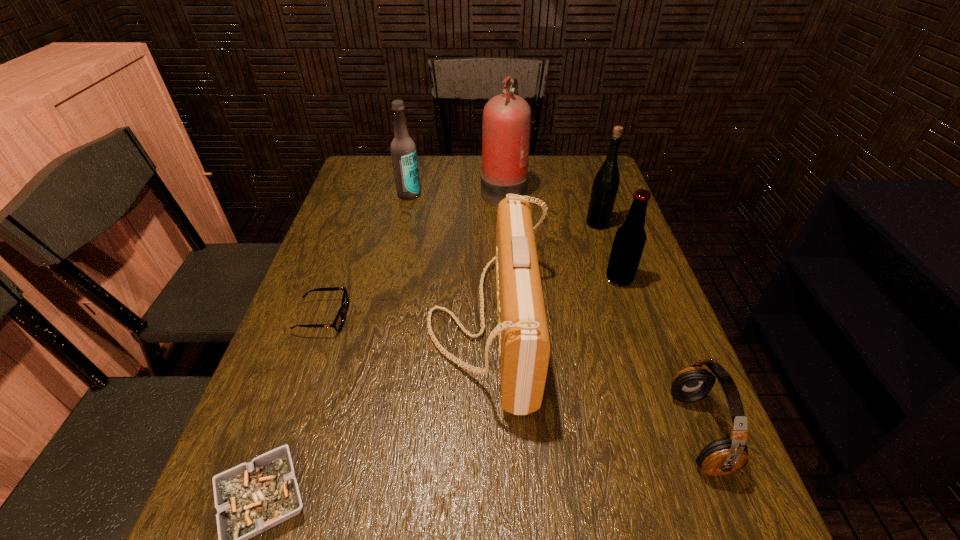
You are a GUI agent. You are given a task and a screenshot of the screen. Output one action in this format:
    pyautogui.click(x=<x>, y=<y>)
    Task: Click on the tallest object
    This screenshot has height=540, width=960.
    Given the screenshot: What is the action you would take?
    pyautogui.click(x=506, y=125)

You are a GUI agent. You are given a task and a screenshot of the screen. Output one action in this format:
    pyautogui.click(x=<x>, y=<y>)
    Task: Click on the leftmost beer bottle
    This screenshot has width=960, height=540.
    Given the screenshot: What is the action you would take?
    pyautogui.click(x=403, y=149)

The image size is (960, 540). Identify the location of the farthest beer bottle. (403, 149).

You are a GUI agent. You are given a task and a screenshot of the screen. Output one action in this format:
    pyautogui.click(x=<x>, y=<y>)
    Task: Click on the second nearest beer bottle
    
    Given the screenshot: What is the action you would take?
    pyautogui.click(x=606, y=183)

Locate an element on the screen. Image resolution: width=960 pixels, height=540 pixels. handbag is located at coordinates (524, 345).

Where is `the nearest beer bottle`? the nearest beer bottle is located at coordinates (630, 238).

Locate an element on the screen. The width and height of the screenshot is (960, 540). the third shortest object is located at coordinates (725, 456).

Locate an element on the screen. The height and width of the screenshot is (540, 960). sunglasses is located at coordinates (338, 323).

Locate an element on the screen. free space located 0.280m at the nozzle of the tallest object is located at coordinates click(393, 189).

At what (x,y) coordinates should I click in order to perform the action: click on vacant space located at the nozzle of the tallest object. Please return your answer as a coordinate pair (x, y). This screenshot has height=540, width=960. Looking at the image, I should click on (444, 189).